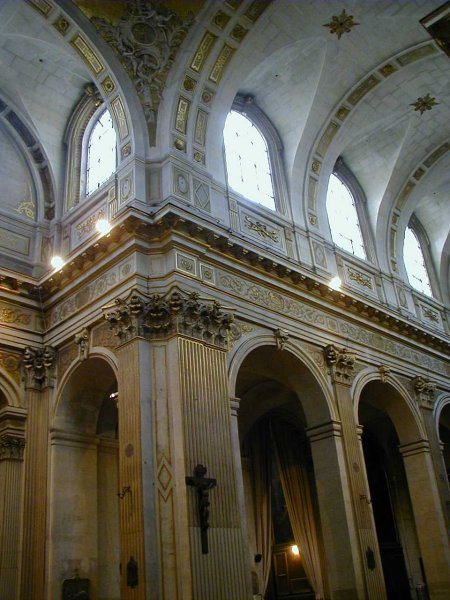
I want to click on ledge, so click(x=196, y=216).